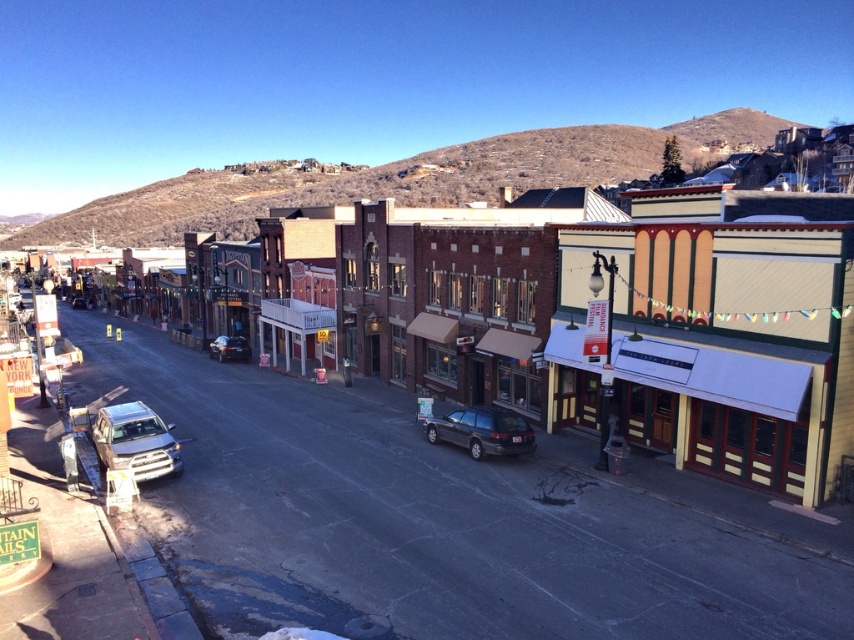
You are a delivery driver who needs to park your truck between the brick building at center and the satin silver suv at lower left. Can you fit your truck there if your truck is 2.5 meters wide?

The brick building at center is wider than the satin silver suv at lower left, but the exact width between them isn

You are a delivery driver who needs to park your truck between the brick building at center and the metallic silver sedan at center. Is there enough space between them for your truck?

Result: The brick building at center is located above the metallic silver sedan at center, meaning they are not aligned horizontally. Therefore, there is no space between them for your truck to park.